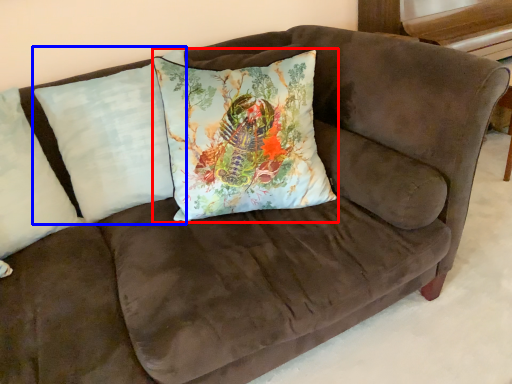
Question: Which object appears farthest to the camera in this image, pillow (highlighted by a red box) or pillow (highlighted by a blue box)?

Choices:
 (A) pillow
 (B) pillow

Answer: (B)